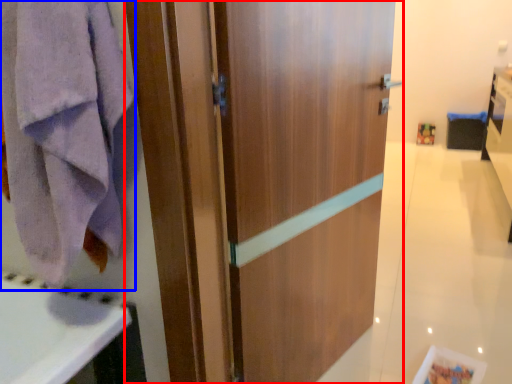
Question: Which object is closer to the camera taking this photo, door (highlighted by a red box) or towel/napkin (highlighted by a blue box)?

Choices:
 (A) door
 (B) towel/napkin

Answer: (A)